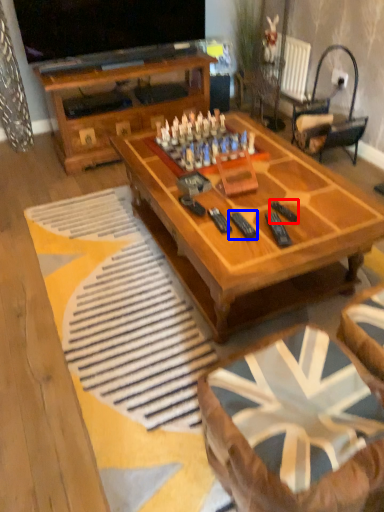
Question: Which point is further to the camera, remote (highlighted by a red box) or remote (highlighted by a blue box)?

Choices:
 (A) remote
 (B) remote

Answer: (A)